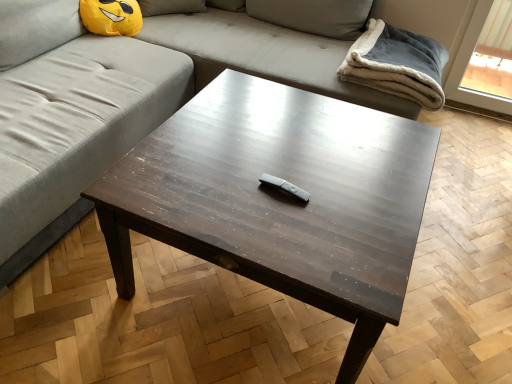
What do you see at coordinates (143, 96) in the screenshot? I see `gray fabric couch at upper center` at bounding box center [143, 96].

Consider the image. Measure the distance between gray matte wii remote at center and camera.

1.23 meters.

Where is `gray fleece blanket at upper right`? This screenshot has height=384, width=512. gray fleece blanket at upper right is located at coordinates (397, 64).

The height and width of the screenshot is (384, 512). I want to click on gray fabric couch at upper center, so click(143, 96).

Is point (243, 275) less distant than point (274, 178)?

Yes, point (243, 275) is closer to viewer.

From the image's perspective, which is below, dark wood remote control at center or gray matte wii remote at center?

From the image's view, dark wood remote control at center is below.

What's the angular difference between dark wood remote control at center and gray matte wii remote at center's facing directions?

101 degrees separate the facing orientations of dark wood remote control at center and gray matte wii remote at center.

Which of these two, dark wood remote control at center or gray matte wii remote at center, is bigger?

dark wood remote control at center is bigger.

What's the angular difference between dark wood remote control at center and gray fabric couch at upper center's facing directions?

dark wood remote control at center and gray fabric couch at upper center are facing 0.325 degrees away from each other.

Is dark wood remote control at center positioned with its back to gray fabric couch at upper center?

Absolutely, dark wood remote control at center is directed away from gray fabric couch at upper center.

Measure the distance from dark wood remote control at center to gray fabric couch at upper center.

dark wood remote control at center and gray fabric couch at upper center are 60.85 centimeters apart.

Is dark wood remote control at center in front of or behind gray fabric couch at upper center in the image?

Clearly, dark wood remote control at center is behind gray fabric couch at upper center.

How different are the orientations of gray fabric couch at upper center and dark wood remote control at center in degrees?

They differ by 0.325 degrees in their facing directions.

Is gray fabric couch at upper center bigger than dark wood remote control at center?

Indeed, gray fabric couch at upper center has a larger size compared to dark wood remote control at center.

Considering the sizes of objects gray fabric couch at upper center and dark wood remote control at center in the image provided, who is wider, gray fabric couch at upper center or dark wood remote control at center?

gray fabric couch at upper center is wider.

Which is more to the left, gray fabric couch at upper center or dark wood remote control at center?

Positioned to the left is gray fabric couch at upper center.

Considering the positions of objects gray fabric couch at upper center and gray fleece blanket at upper right in the image provided, who is in front, gray fabric couch at upper center or gray fleece blanket at upper right?

gray fabric couch at upper center is closer to the camera.

How different are the orientations of gray fabric couch at upper center and gray fleece blanket at upper right in degrees?

They differ by 1.26 degrees in their facing directions.

This screenshot has width=512, height=384. In order to click on studio couch that appears on the left of gray fleece blanket at upper right in this screenshot , I will do `click(143, 96)`.

Choose the correct answer: Is gray fabric couch at upper center inside gray fleece blanket at upper right or outside it?

gray fabric couch at upper center lies outside gray fleece blanket at upper right.

Looking at this image, from a real-world perspective, is dark wood remote control at center physically located above or below gray fleece blanket at upper right?

From a real-world perspective, dark wood remote control at center is physically below gray fleece blanket at upper right.

From the image's perspective, which one is positioned higher, dark wood remote control at center or gray fleece blanket at upper right?

From the image's view, gray fleece blanket at upper right is above.

The width and height of the screenshot is (512, 384). In order to click on blanket located above the dark wood remote control at center (from a real-world perspective) in this screenshot , I will do `click(397, 64)`.

Could you tell me if gray matte wii remote at center is turned towards gray fleece blanket at upper right?

No, gray matte wii remote at center is not facing towards gray fleece blanket at upper right.

In the image, there is a gray matte wii remote at center. Where is `blanket above it (from the image's perspective)`? The image size is (512, 384). blanket above it (from the image's perspective) is located at coordinates (397, 64).

From the image's perspective, relative to gray fleece blanket at upper right, is gray matte wii remote at center above or below?

From the image's perspective, gray matte wii remote at center appears below gray fleece blanket at upper right.

Does gray matte wii remote at center have a lesser height compared to gray fleece blanket at upper right?

Yes.

Is gray fabric couch at upper center located outside gray matte wii remote at center?

Indeed, gray fabric couch at upper center is completely outside gray matte wii remote at center.

Does point (336, 10) come closer to viewer compared to point (281, 189)?

That is False.

Which is in front, gray fabric couch at upper center or gray matte wii remote at center?

gray fabric couch at upper center is closer to the camera.

Considering the sizes of gray fabric couch at upper center and gray matte wii remote at center in the image, is gray fabric couch at upper center wider or thinner than gray matte wii remote at center?

In the image, gray fabric couch at upper center appears to be wider than gray matte wii remote at center.

You are a GUI agent. You are given a task and a screenshot of the screen. Output one action in this format:
    pyautogui.click(x=<x>, y=<y>)
    Task: Click on the Wii controller above the dark wood remote control at center (from a real-world perspective)
    The height and width of the screenshot is (384, 512).
    Given the screenshot: What is the action you would take?
    pyautogui.click(x=285, y=187)

The width and height of the screenshot is (512, 384). In order to click on coffee table on the right side of gray fabric couch at upper center in this screenshot , I will do `click(280, 198)`.

When comparing their distances from gray matte wii remote at center, does gray fleece blanket at upper right or dark wood remote control at center seem closer?

Among the two, dark wood remote control at center is located nearer to gray matte wii remote at center.

From the image, which object appears to be nearer to gray matte wii remote at center, dark wood remote control at center or gray fleece blanket at upper right?

Among the two, dark wood remote control at center is located nearer to gray matte wii remote at center.

When comparing their distances from dark wood remote control at center, does gray fabric couch at upper center or gray matte wii remote at center seem closer?

Among the two, gray matte wii remote at center is located nearer to dark wood remote control at center.

When comparing their distances from dark wood remote control at center, does gray matte wii remote at center or gray fabric couch at upper center seem closer?

gray matte wii remote at center lies closer to dark wood remote control at center than the other object.

Looking at the image, which one is located further to dark wood remote control at center, gray fleece blanket at upper right or gray matte wii remote at center?

gray fleece blanket at upper right is further to dark wood remote control at center.

When comparing their distances from gray fleece blanket at upper right, does gray fabric couch at upper center or dark wood remote control at center seem closer?

gray fabric couch at upper center lies closer to gray fleece blanket at upper right than the other object.

From the image, which object appears to be nearer to gray fleece blanket at upper right, dark wood remote control at center or gray matte wii remote at center?

The object closer to gray fleece blanket at upper right is dark wood remote control at center.

When comparing their distances from gray fabric couch at upper center, does dark wood remote control at center or gray matte wii remote at center seem closer?

dark wood remote control at center.

Image resolution: width=512 pixels, height=384 pixels. I want to click on coffee table between gray fabric couch at upper center and gray fleece blanket at upper right in the front-back direction, so click(280, 198).

Locate an element on the screen. The image size is (512, 384). Wii controller located between gray fabric couch at upper center and gray fleece blanket at upper right in the depth direction is located at coordinates (285, 187).

Find the location of `coffee table between gray fabric couch at upper center and gray matte wii remote at center along the z-axis`. coffee table between gray fabric couch at upper center and gray matte wii remote at center along the z-axis is located at coordinates (280, 198).

Image resolution: width=512 pixels, height=384 pixels. I want to click on Wii controller between dark wood remote control at center and gray fleece blanket at upper right from front to back, so click(285, 187).